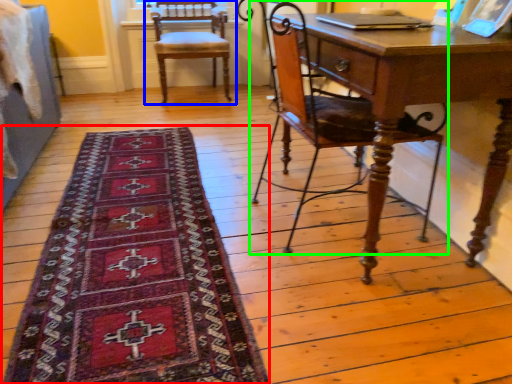
Question: Which object is positioned closest to mat (highlighted by a red box)? Select from chair (highlighted by a blue box) and chair (highlighted by a green box).

Choices:
 (A) chair
 (B) chair

Answer: (B)